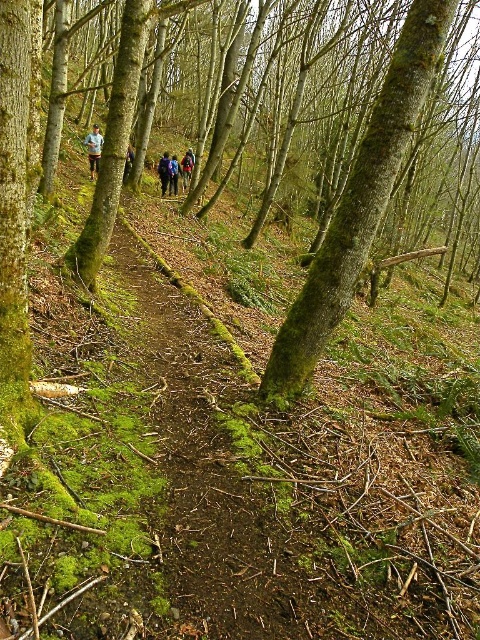
Question: Is green mossy tree trunk at center below blue fabric backpack at center?

Choices:
 (A) yes
 (B) no

Answer: (A)

Question: Is light blue shirt at center positioned at the back of camouflage jacket at center?

Choices:
 (A) no
 (B) yes

Answer: (A)

Question: Estimate the real-world distances between objects in this image. Which object is farther from the orange fabric jacket at center?

Choices:
 (A) light blue shirt at center
 (B) green mossy tree trunk at center
 (C) blue fabric jacket at center

Answer: (B)

Question: Among these objects, which one is nearest to the camera?

Choices:
 (A) orange fabric jacket at center
 (B) camouflage jacket at center
 (C) light blue shirt at center

Answer: (C)

Question: Estimate the real-world distances between objects in this image. Which object is closer to the green mossy tree at center?

Choices:
 (A) orange fabric jacket at center
 (B) green mossy tree trunk at center

Answer: (A)

Question: Can you confirm if orange fabric jacket at center is bigger than blue fabric jacket at center?

Choices:
 (A) no
 (B) yes

Answer: (A)